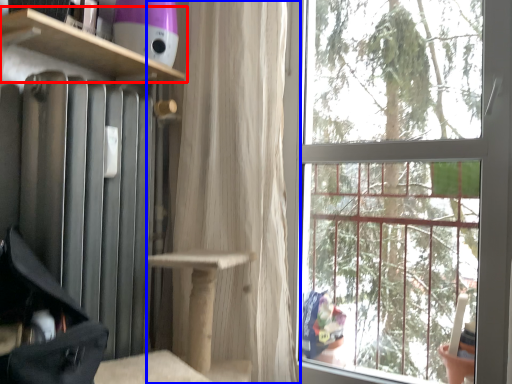
Question: Among these objects, which one is farthest to the camera, shelf (highlighted by a red box) or curtain (highlighted by a blue box)?

Choices:
 (A) shelf
 (B) curtain

Answer: (B)